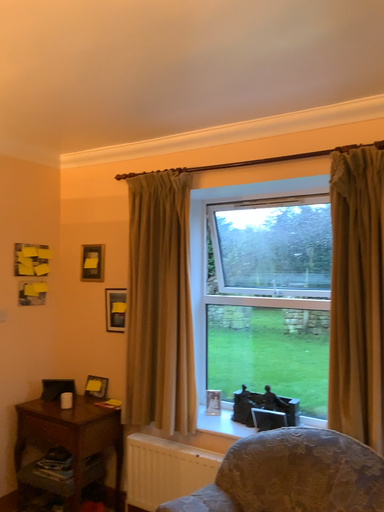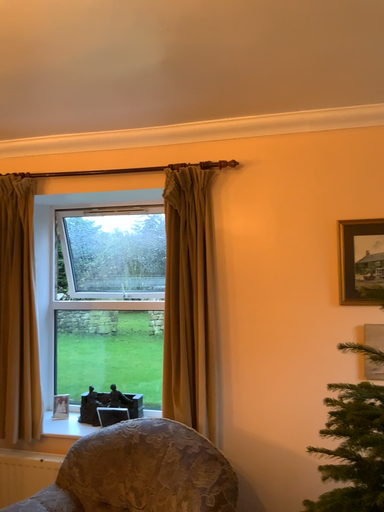
Question: How did the camera likely rotate when shooting the video?

Choices:
 (A) rotated right
 (B) rotated left

Answer: (A)